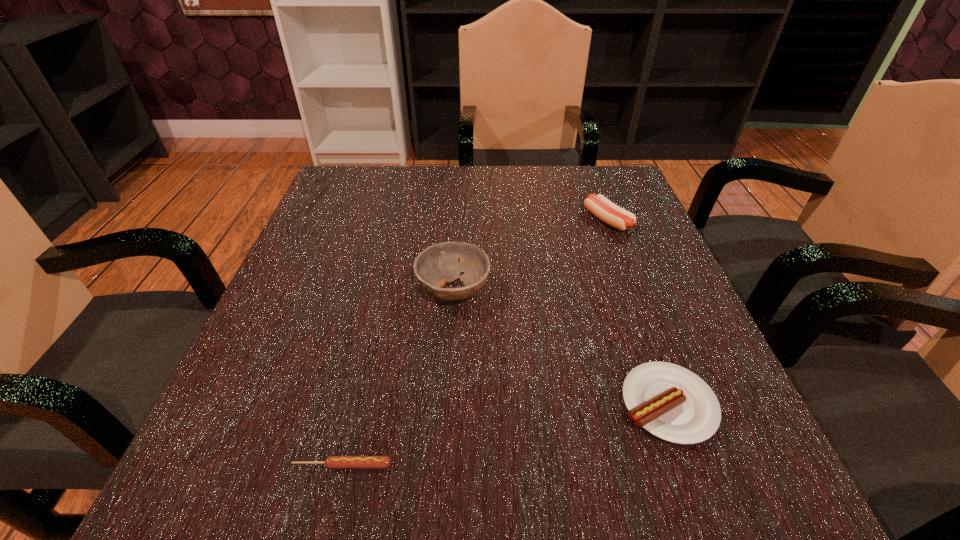
I want to click on the tallest object, so click(442, 263).

The height and width of the screenshot is (540, 960). Identify the location of the second farthest object. (442, 263).

Find the location of a particular element. The image size is (960, 540). the farthest sausage is located at coordinates (601, 207).

You are a GUI agent. You are given a task and a screenshot of the screen. Output one action in this format:
    pyautogui.click(x=<x>, y=<y>)
    Task: Click on the third tallest object
    This screenshot has width=960, height=540.
    Given the screenshot: What is the action you would take?
    pyautogui.click(x=672, y=403)

Where is `the second farthest sausage`? This screenshot has width=960, height=540. the second farthest sausage is located at coordinates (672, 403).

The width and height of the screenshot is (960, 540). I want to click on the nearest sausage, so click(x=331, y=462).

Where is `the shortest sausage`? Image resolution: width=960 pixels, height=540 pixels. the shortest sausage is located at coordinates (331, 462).

You are a GUI agent. You are given a task and a screenshot of the screen. Output one action in this format:
    pyautogui.click(x=<x>, y=<y>)
    Task: Click on the vacant position located 0.240m on the left of the tallest object
    The width and height of the screenshot is (960, 540).
    Given the screenshot: What is the action you would take?
    pyautogui.click(x=288, y=291)

Find the location of `vacant area situated 0.150m on the front of the farthest sausage`. vacant area situated 0.150m on the front of the farthest sausage is located at coordinates (631, 285).

This screenshot has height=540, width=960. What are the coordinates of `free space located 0.140m on the left of the second nearest object` in the screenshot? It's located at (523, 404).